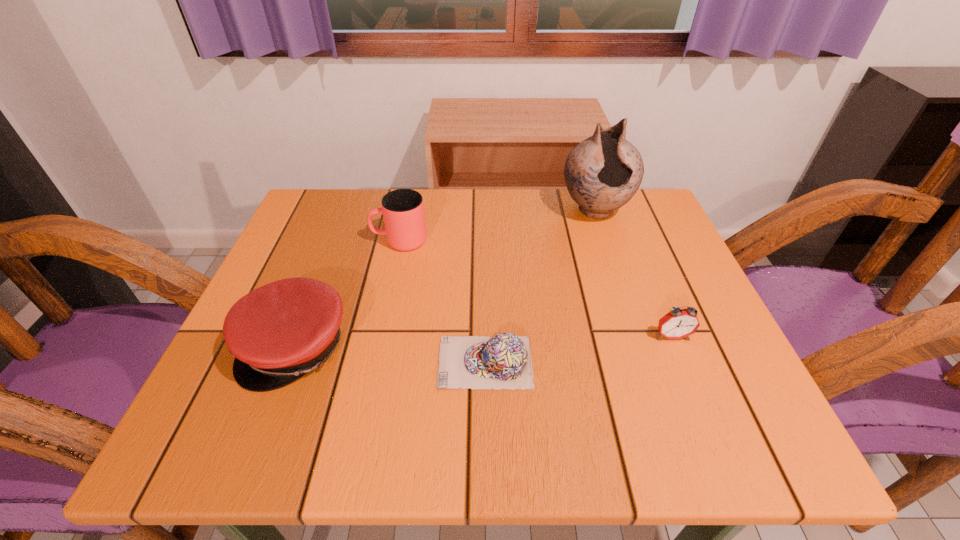
Find the location of a particular element. vacant point located between the cup and the shorter cap is located at coordinates (443, 302).

At what (x,y) coordinates should I click in order to perform the action: click on vacant space that's between the fourth shortest object and the right cap. Please return your answer as a coordinate pair (x, y). Image resolution: width=960 pixels, height=540 pixels. Looking at the image, I should click on (443, 302).

Identify the location of free space between the fourth shortest object and the taller cap. This screenshot has width=960, height=540. (348, 294).

The width and height of the screenshot is (960, 540). Find the location of `vacant area between the cup and the left cap`. vacant area between the cup and the left cap is located at coordinates (348, 294).

Locate an element on the screen. free space between the alarm clock and the cup is located at coordinates (536, 289).

Where is `the fourth closest object to the alarm clock`? This screenshot has height=540, width=960. the fourth closest object to the alarm clock is located at coordinates (277, 333).

Choose which object is the second nearest neighbor to the third object from left to right. Please provide its 2D coordinates. Your answer should be formatted as a tuple, i.e. [(x, y)], where the tuple contains the x and y coordinates of a point satisfying the conditions above.

[(679, 323)]

This screenshot has width=960, height=540. I want to click on free space in the image that satisfies the following two spatial constraints: 1. on the clock face of the alarm clock; 2. on the front, side, and top of the right cap, so click(x=683, y=362).

You are a GUI agent. You are given a task and a screenshot of the screen. Output one action in this format:
    pyautogui.click(x=<x>, y=<y>)
    Task: Click on the vacant region that satisfies the following two spatial constraints: 1. from the spout of the tallest object; 2. on the front, side, and top of the right cap
    Image resolution: width=960 pixels, height=540 pixels.
    Given the screenshot: What is the action you would take?
    pyautogui.click(x=646, y=362)

I want to click on free space that satisfies the following two spatial constraints: 1. from the spout of the pottery; 2. on the front, side, and top of the third object from left to right, so click(646, 362).